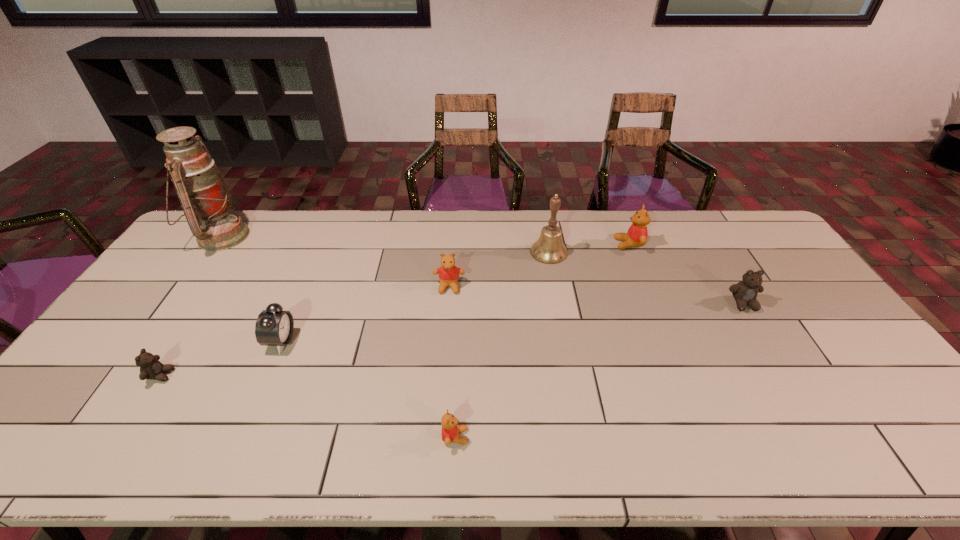
Image resolution: width=960 pixels, height=540 pixels. Find the location of `vacant space located on the face of the farther brown teddy bear`. vacant space located on the face of the farther brown teddy bear is located at coordinates (763, 337).

Locate an element on the screen. The image size is (960, 540). free space located on the front-facing side of the second biggest red teddy bear is located at coordinates (444, 357).

Locate an element on the screen. blank space located on the front side of the third object from left to right is located at coordinates (357, 341).

At what (x,y) coordinates should I click in order to perform the action: click on vacant space located on the face of the nearer brown teddy bear. Please return your answer as a coordinate pair (x, y). This screenshot has height=540, width=960. Looking at the image, I should click on (196, 375).

Where is `vacant space situated on the front-facing side of the nearest red teddy bear`? The height and width of the screenshot is (540, 960). vacant space situated on the front-facing side of the nearest red teddy bear is located at coordinates (581, 437).

You are a GUI agent. You are given a task and a screenshot of the screen. Output one action in this format:
    pyautogui.click(x=<x>, y=<y>)
    Task: Click on the oil lamp that is at the far edge
    The height and width of the screenshot is (540, 960).
    Given the screenshot: What is the action you would take?
    pyautogui.click(x=205, y=198)

This screenshot has width=960, height=540. Find the location of `bell located at the far edge`. bell located at the far edge is located at coordinates (549, 249).

At what (x,y) coordinates should I click in order to perform the action: click on teddy bear that is at the far edge. Please return your answer as a coordinate pair (x, y). Looking at the image, I should click on (x=637, y=234).

This screenshot has height=540, width=960. Find the location of `object positioned at the near edge`. object positioned at the near edge is located at coordinates (450, 430).

The image size is (960, 540). In order to click on object that is at the left edge in this screenshot , I will do `click(205, 198)`.